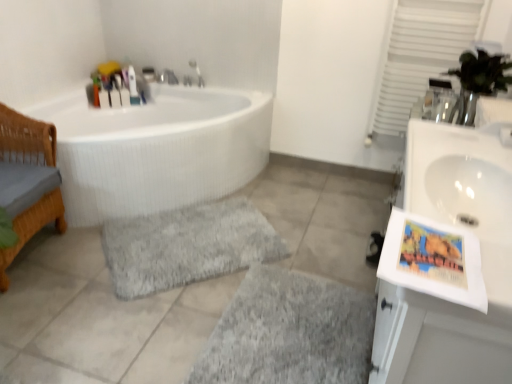
Find the location of a particular element. empty space that is ontop of gray shaggy rug at center, arranged as the first bath mat when ordered from the bottom is located at coordinates (291, 327).